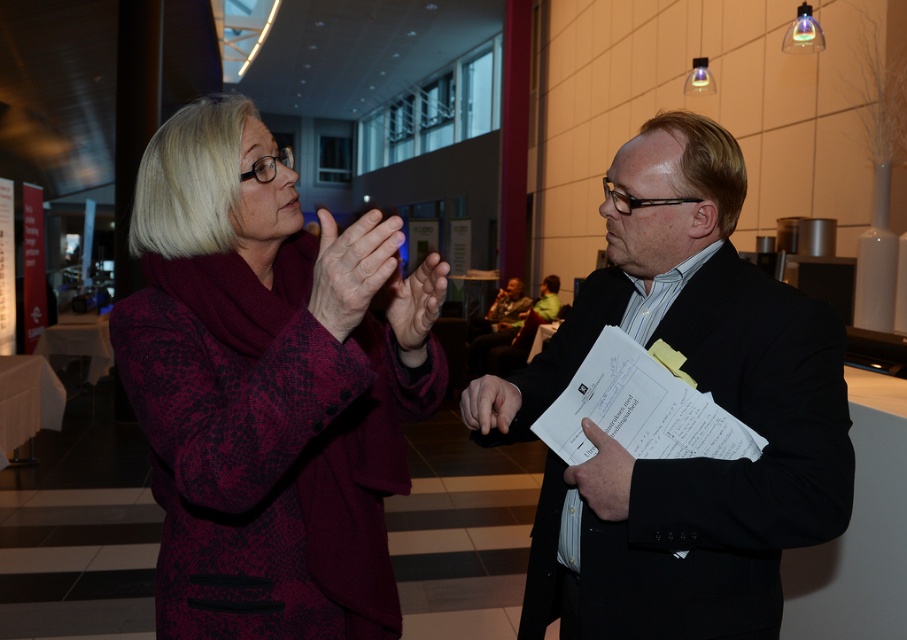
From the picture: In the image, where is the maroon textured coat at center located in terms of coordinates?

The maroon textured coat at center is located at point coordinates of [266,388].

You are a photographer setting up for a group photo in the conference hall. You need to position the maroon textured coat at center and the black matte suit at center so that both are clearly visible. Given their sizes, which object should you place closer to the camera to ensure both appear equally sized in the photo?

The maroon textured coat at center is larger in size than the black matte suit at center. To make them appear equally sized in the photo, the black matte suit at center should be placed closer to the camera since it is smaller in actual size and needs to be magnified to match the visual size of the larger maroon textured coat at center.

You are standing at the entrance of the conference hall and see the maroon textured coat at center. If your camera has a focal length of 50mm and you want to take a photo where the coat fills the frame vertically, would you need to zoom in or out?

Since the maroon textured coat at center is 37.50 inches away from the camera, you would need to zoom out to capture it filling the frame vertically without cropping.